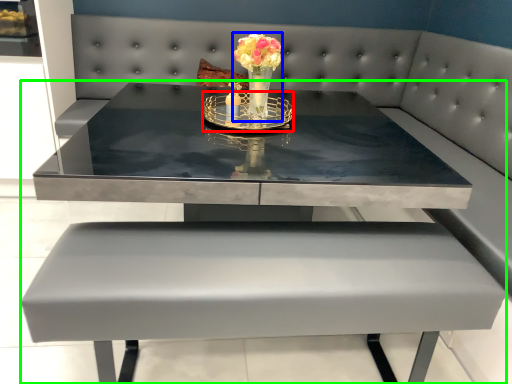
Question: Which object is the farthest from candle holder (highlighted by a red box)? Choose among these: floral arrangement (highlighted by a blue box) or table (highlighted by a green box).

Choices:
 (A) floral arrangement
 (B) table

Answer: (B)